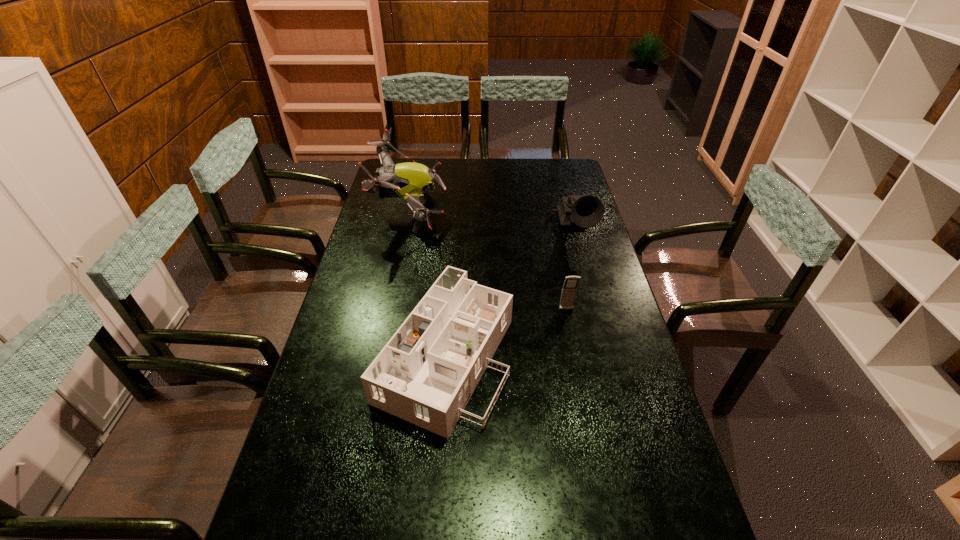
The image size is (960, 540). I want to click on drone, so click(x=409, y=181).

Locate an element on the screen. phonograph_record is located at coordinates (587, 211).

This screenshot has width=960, height=540. In order to click on cellular telephone in this screenshot , I will do `click(569, 289)`.

The image size is (960, 540). In order to click on the shortest object in this screenshot , I will do `click(426, 373)`.

Where is `vacant space located on the front-facing side of the drone`? Image resolution: width=960 pixels, height=540 pixels. vacant space located on the front-facing side of the drone is located at coordinates (484, 211).

Locate an element on the screen. blank space located 0.240m from the horn of the third shortest object is located at coordinates (594, 295).

The height and width of the screenshot is (540, 960). I want to click on vacant space positioned on the front-facing side of the cellular telephone, so point(574,349).

The width and height of the screenshot is (960, 540). I want to click on vacant space located 0.100m on the right of the shortest object, so click(548, 355).

Where is `object located in the far edge section of the desktop`? Image resolution: width=960 pixels, height=540 pixels. object located in the far edge section of the desktop is located at coordinates (409, 181).

Locate an element on the screen. object positioned at the left edge is located at coordinates (409, 181).